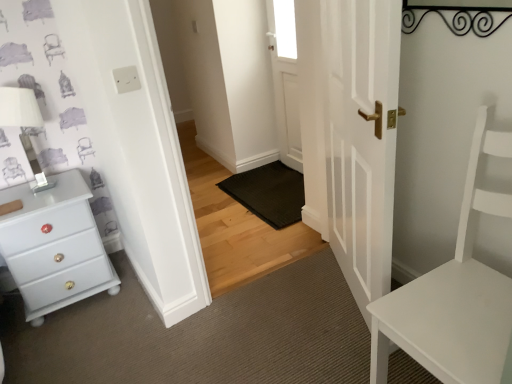
Find the location of a particular element. vacant point above matte white chest of drawers at left (from a real-world perspective) is located at coordinates (28, 195).